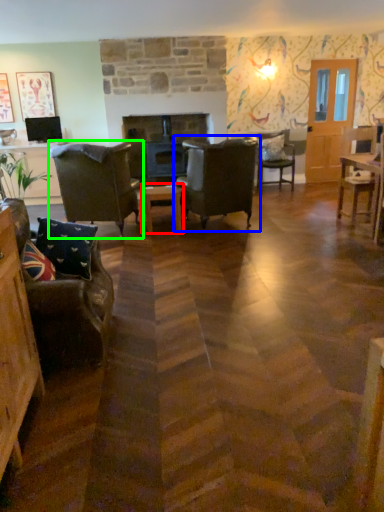
Question: Which object is positioned farthest from table (highlighted by a red box)? Select from chair (highlighted by a blue box) and chair (highlighted by a green box).

Choices:
 (A) chair
 (B) chair

Answer: (B)